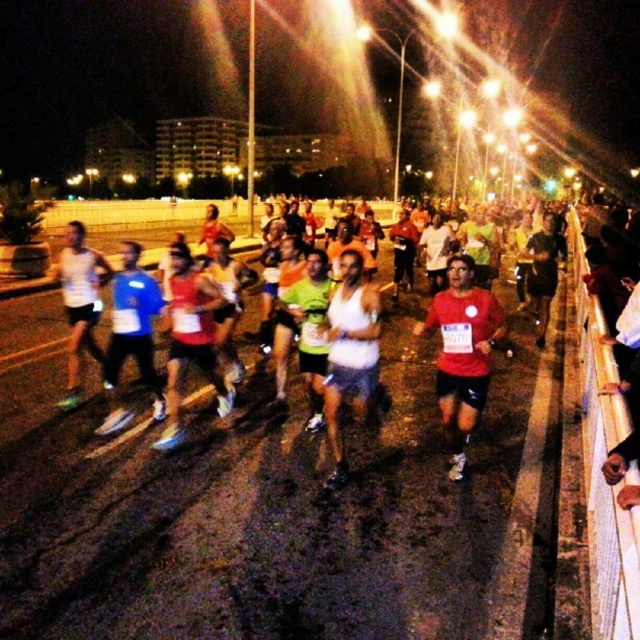
Question: Observing the image, what is the correct spatial positioning of red matte shirt at center in reference to white matte tank top at center?

Choices:
 (A) left
 (B) right

Answer: (B)

Question: Is white fabric tank top at center further to the viewer compared to white matte tank top at center?

Choices:
 (A) yes
 (B) no

Answer: (A)

Question: Estimate the real-world distances between objects in this image. Which object is farther from the white fabric tank top at center?

Choices:
 (A) red matte shirt at center
 (B) white matte tank top at center

Answer: (A)

Question: In this image, where is white fabric tank top at center located relative to red matte shirt at center?

Choices:
 (A) above
 (B) below

Answer: (A)

Question: Which object appears closest to the camera in this image?

Choices:
 (A) red matte shirt at center
 (B) white matte tank top at center
 (C) white fabric tank top at center

Answer: (B)

Question: Which object is closer to the camera taking this photo?

Choices:
 (A) white matte tank top at center
 (B) red matte shirt at center
 (C) white fabric tank top at center

Answer: (A)